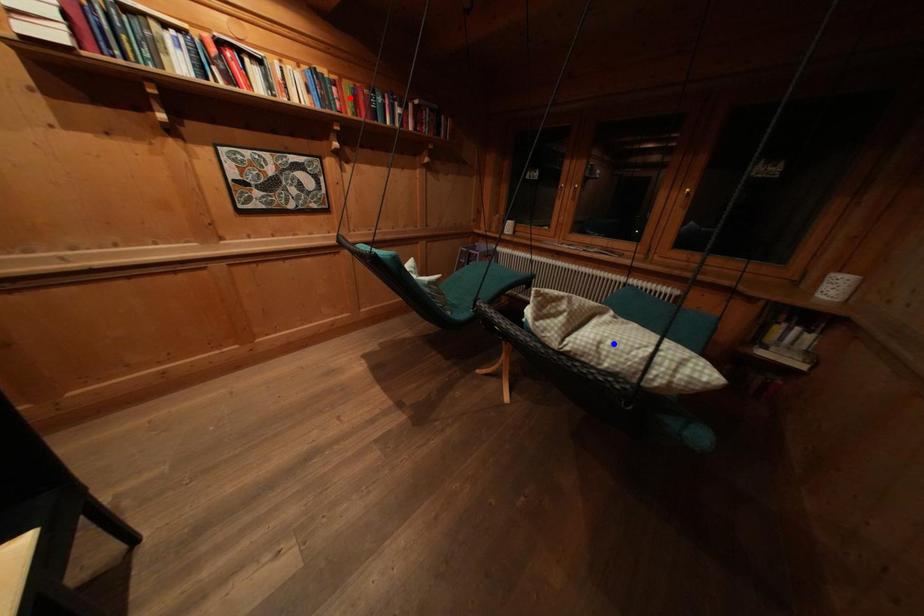
Question: Which of the two points in the image is closer to the camera?

Choices:
 (A) Blue point is closer.
 (B) Red point is closer.

Answer: (A)